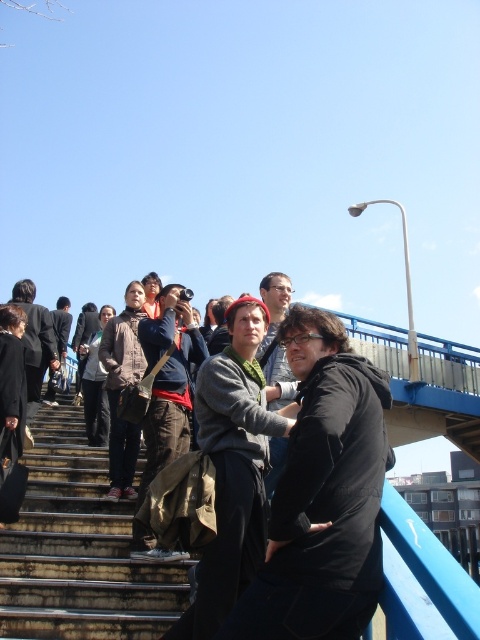
You are a photographer trying to capture a wide shot of the scene. You notice the dark gray hoodie at center and the rusty metal stairs at lower left. Which object would require a wider angle lens to include its full width in the frame?

The dark gray hoodie at center requires a wider angle lens because its width surpasses that of the rusty metal stairs at lower left, making it necessary to capture a broader view to include its full width.